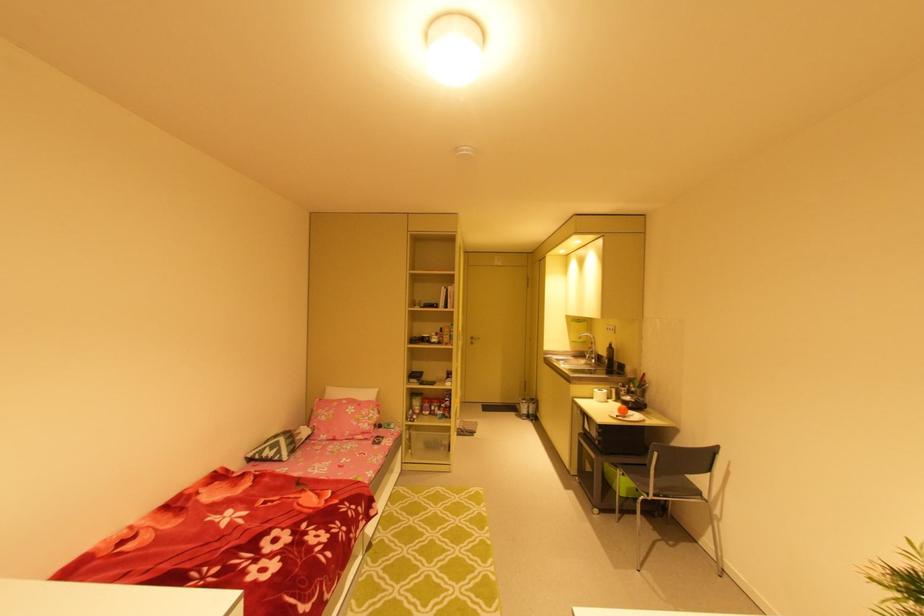
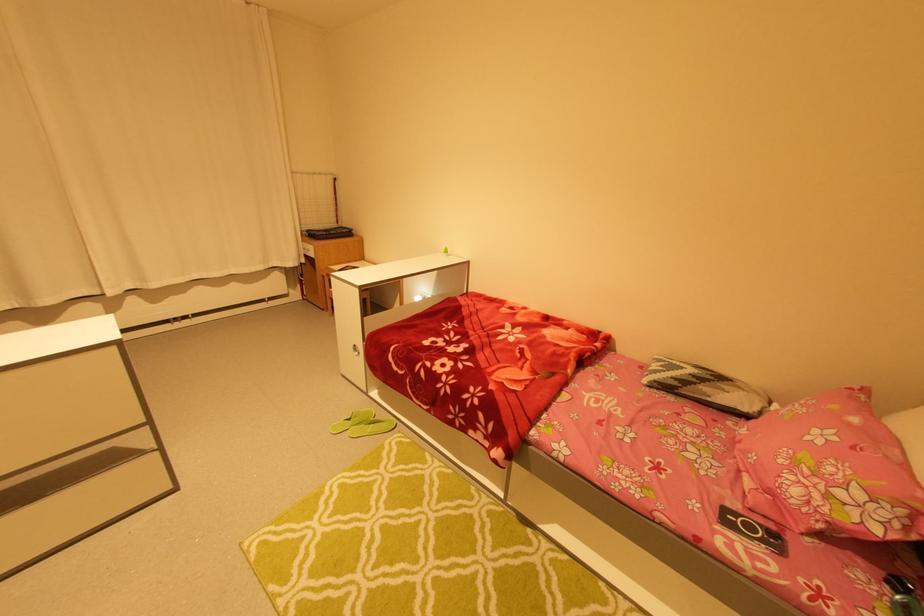
The point at (381, 411) is marked in the first image. Where is the corresponding point in the second image?

(891, 515)